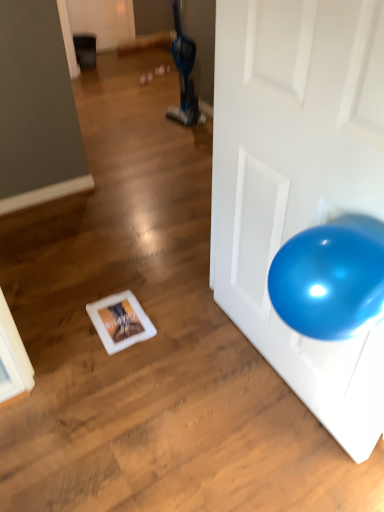
At what (x,y) coordinates should I click in order to perform the action: click on vacant space to the left of glossy white door at right. Please return your answer as a coordinate pair (x, y). The image size is (384, 512). Looking at the image, I should click on (173, 390).